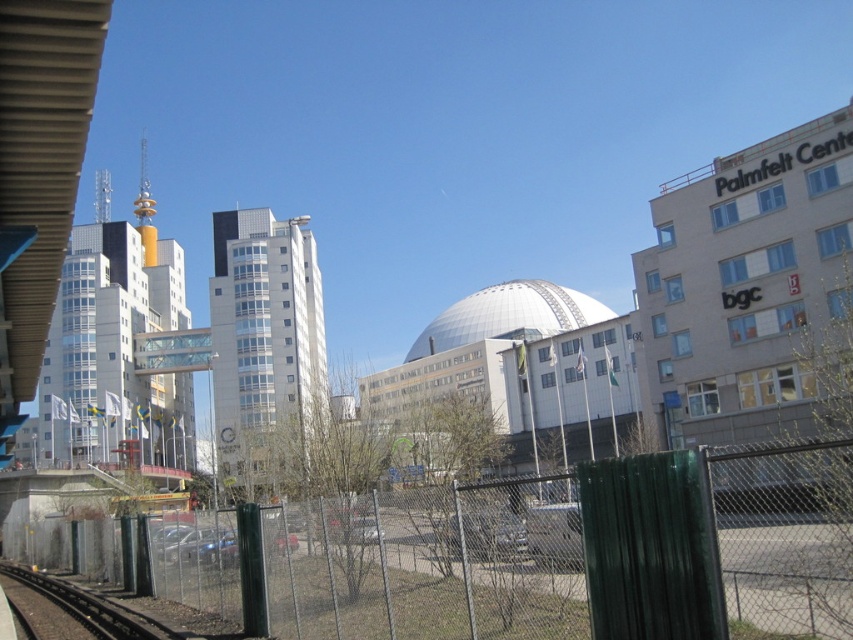
Does green chain-link fence at center have a larger size compared to black metal train track at lower left?

No.

Is the position of green chain-link fence at center less distant than that of black metal train track at lower left?

Yes, it is.

Is point (512, 490) farther from camera compared to point (86, 602)?

No, it is in front of (86, 602).

Locate an element on the screen. The width and height of the screenshot is (853, 640). green chain-link fence at center is located at coordinates (578, 552).